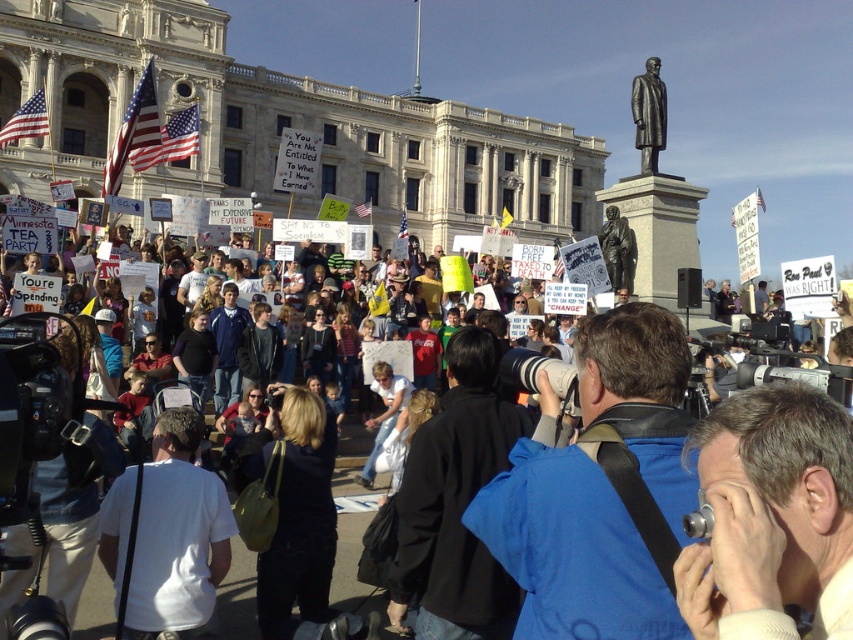
Question: Among these objects, which one is nearest to the camera?

Choices:
 (A) blue fabric camera at center
 (B) bronze statue at upper center
 (C) bronze statue at center

Answer: (A)

Question: Is blue fabric camera at center further to the viewer compared to bronze statue at upper center?

Choices:
 (A) no
 (B) yes

Answer: (A)

Question: Which point is closer to the camera taking this photo?

Choices:
 (A) (630, 253)
 (B) (654, 592)

Answer: (B)

Question: Is blue fabric camera at center to the left of bronze statue at center from the viewer's perspective?

Choices:
 (A) yes
 (B) no

Answer: (A)

Question: Which object is the farthest from the blue fabric camera at center?

Choices:
 (A) bronze statue at upper center
 (B) bronze statue at center

Answer: (A)

Question: Is blue fabric camera at center above bronze statue at upper center?

Choices:
 (A) yes
 (B) no

Answer: (B)